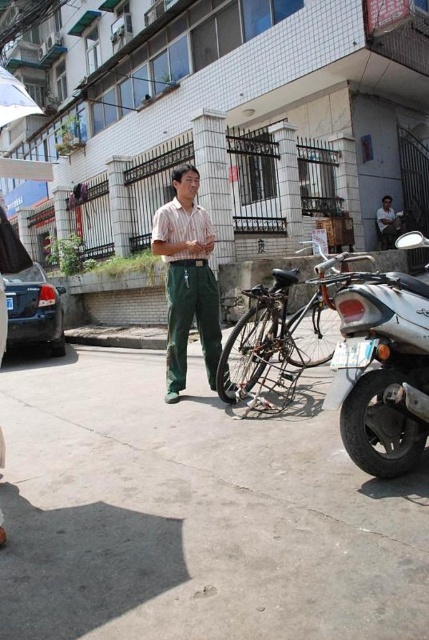
Can you confirm if silver metallic motorcycle at lower right is positioned to the left of white fabric umbrella at upper left?

Incorrect, silver metallic motorcycle at lower right is not on the left side of white fabric umbrella at upper left.

Does point (344, 337) lie behind point (21, 112)?

Yes, it is behind point (21, 112).

At what (x,y) coordinates should I click in order to perform the action: click on silver metallic motorcycle at lower right. Please return your answer as a coordinate pair (x, y). The width and height of the screenshot is (429, 640). Looking at the image, I should click on (381, 369).

Which is more to the left, silver metallic motorcycle at lower right or striped fabric shirt at center?

Positioned to the left is striped fabric shirt at center.

Can you confirm if silver metallic motorcycle at lower right is wider than striped fabric shirt at center?

In fact, silver metallic motorcycle at lower right might be narrower than striped fabric shirt at center.

Where is `silver metallic motorcycle at lower right`? silver metallic motorcycle at lower right is located at coordinates (381, 369).

In order to click on silver metallic motorcycle at lower right in this screenshot , I will do `click(381, 369)`.

Is white fabric umbrella at upper left to the right of matte green pants at center from the viewer's perspective?

In fact, white fabric umbrella at upper left is to the left of matte green pants at center.

Who is positioned more to the left, white fabric umbrella at upper left or matte green pants at center?

Positioned to the left is white fabric umbrella at upper left.

The image size is (429, 640). In order to click on white fabric umbrella at upper left in this screenshot , I will do `click(15, 99)`.